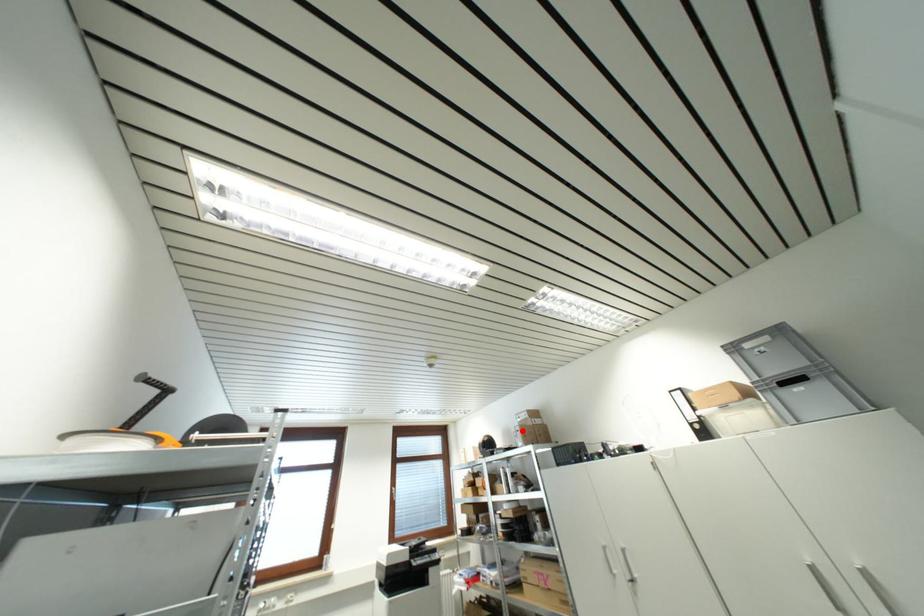
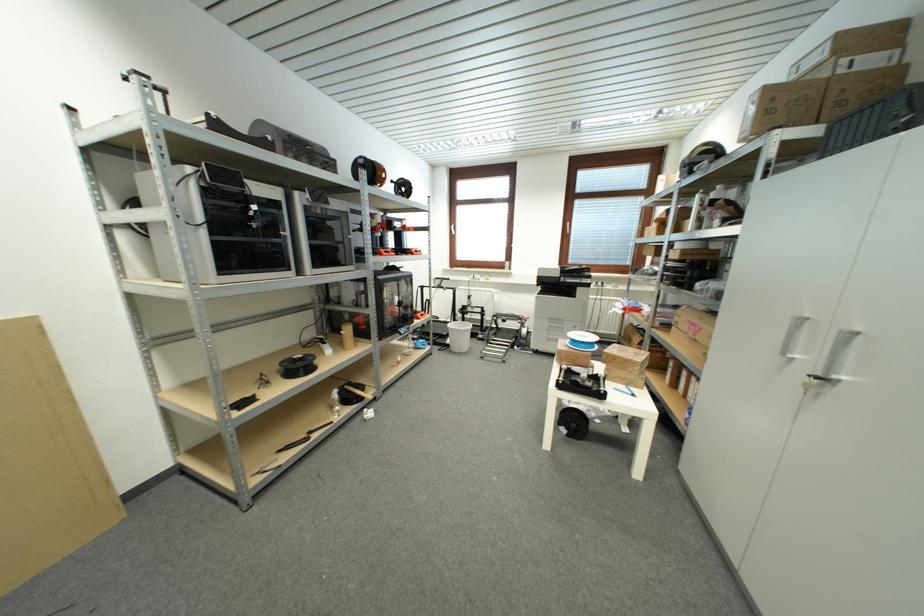
Where in the second image is the point corresponding to the highlighted location from the first image?

(761, 99)